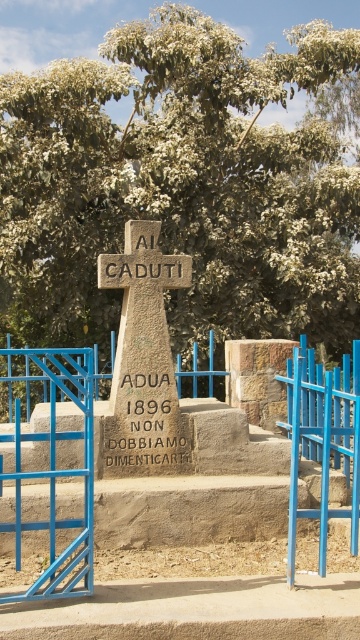
Between green leafy tree at center and stone cross at center, which one appears on the right side from the viewer's perspective?

Positioned to the right is green leafy tree at center.

Is green leafy tree at center wider than stone cross at center?

Yes.

The image size is (360, 640). I want to click on green leafy tree at center, so click(x=183, y=182).

Between point (61, 220) and point (96, 467), which one is positioned in front?

Point (96, 467)

Is green leafy tree at center to the left of brown stone stairs at center from the viewer's perspective?

Incorrect, green leafy tree at center is not on the left side of brown stone stairs at center.

What do you see at coordinates (183, 182) in the screenshot? The width and height of the screenshot is (360, 640). I see `green leafy tree at center` at bounding box center [183, 182].

Identify the location of green leafy tree at center. Image resolution: width=360 pixels, height=640 pixels. (183, 182).

Does brown stone stairs at center have a larger size compared to stone cross at center?

Indeed, brown stone stairs at center has a larger size compared to stone cross at center.

The image size is (360, 640). What are the coordinates of `brown stone stairs at center` in the screenshot? It's located at (198, 484).